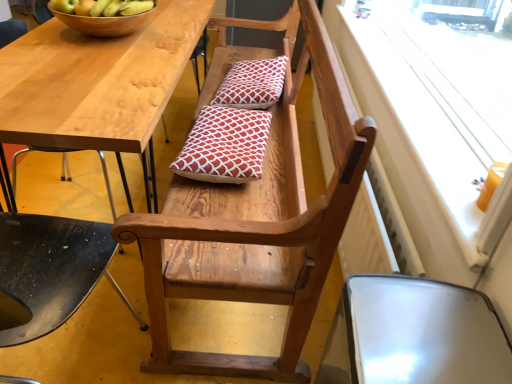
Question: Would you say green matte apple at upper left, which ranks as the 1th apple in right-to-left order, is to the left or to the right of red printed cushion at center, which is the first pillow from back to front, in the picture?

Choices:
 (A) left
 (B) right

Answer: (A)

Question: Does point (87, 6) appear closer or farther from the camera than point (278, 82)?

Choices:
 (A) farther
 (B) closer

Answer: (B)

Question: Which is farther from the green matte apple at upper left, positioned as the second apple in left-to-right order?

Choices:
 (A) red printed cushion at center, the 1th pillow viewed from the top
 (B) wooden bowl at upper left
 (C) green matte apple at upper left, the 1th apple in the left-to-right sequence
 (D) red printed cushion at center, marked as the 2th pillow in a back-to-front arrangement
 (E) metallic silver chair at lower right, which is counted as the 3th chair, starting from the left

Answer: (E)

Question: Estimate the real-world distances between objects in this image. Which object is farther from the wooden chair at center, which is counted as the second chair, starting from the left?

Choices:
 (A) wooden chair at lower center, which appears as the 3th chair when viewed from the right
 (B) red printed cushion at center, the 1th pillow viewed from the top
 (C) wooden bowl at upper left
 (D) white matte window screen at upper right
 (E) metallic silver chair at lower right, which is counted as the 3th chair, starting from the left

Answer: (C)